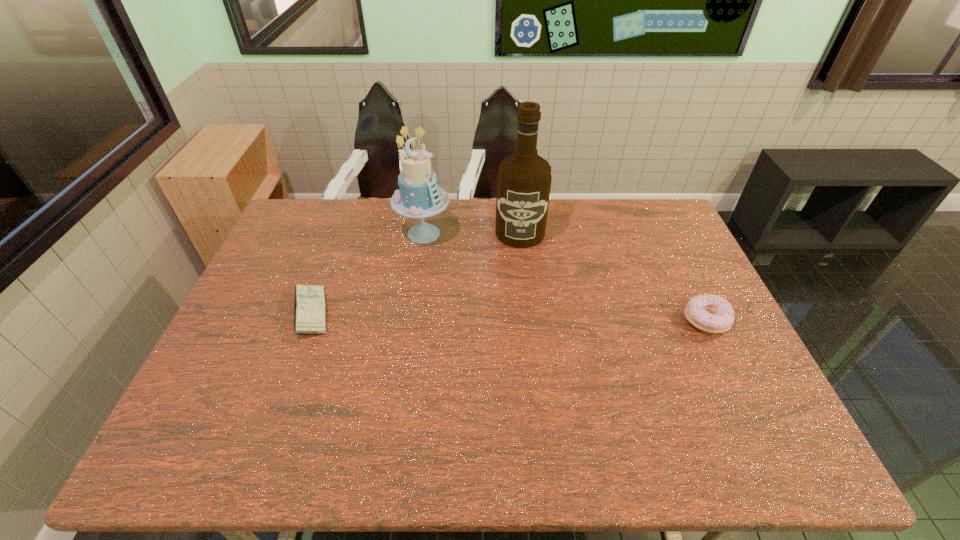
Where is `free space between the alcohol and the rightmost object`? free space between the alcohol and the rightmost object is located at coordinates (613, 277).

At what (x,y) coordinates should I click in order to perform the action: click on free spot between the leftmost object and the doughnut. Please return your answer as a coordinate pair (x, y). The width and height of the screenshot is (960, 540). Looking at the image, I should click on (509, 317).

Image resolution: width=960 pixels, height=540 pixels. Identify the location of object that is the third closest to the leftmost object. (710, 313).

Locate an element on the screen. Image resolution: width=960 pixels, height=540 pixels. object that stands as the closest to the alcohol is located at coordinates (419, 196).

Find the location of a particular element. free space that satisfies the following two spatial constraints: 1. on the back side of the alcohol; 2. on the right side of the leftmost object is located at coordinates (341, 233).

The height and width of the screenshot is (540, 960). Find the location of `free point that satisfies the following two spatial constraints: 1. on the front side of the doughnut; 2. on the right side of the alcohol`. free point that satisfies the following two spatial constraints: 1. on the front side of the doughnut; 2. on the right side of the alcohol is located at coordinates (529, 321).